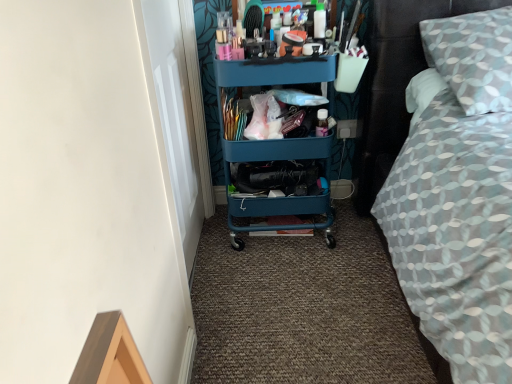
What are the coordinates of `vacant area situated below teal plastic cart at center (from a real-world perspective)` in the screenshot? It's located at (283, 235).